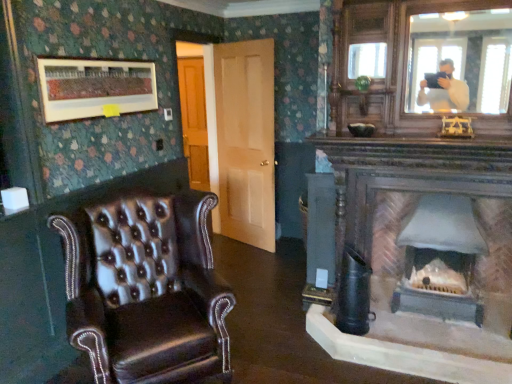
Question: Can you confirm if light brown wood door at center is positioned to the left of matte gray stone fireplace at center?

Choices:
 (A) no
 (B) yes

Answer: (B)

Question: Considering the relative sizes of light brown wood door at center and matte gray stone fireplace at center in the image provided, is light brown wood door at center smaller than matte gray stone fireplace at center?

Choices:
 (A) no
 (B) yes

Answer: (A)

Question: Are light brown wood door at center and matte gray stone fireplace at center making contact?

Choices:
 (A) yes
 (B) no

Answer: (B)

Question: From the image's perspective, is light brown wood door at center over matte gray stone fireplace at center?

Choices:
 (A) yes
 (B) no

Answer: (A)

Question: Considering the relative sizes of light brown wood door at center and matte gray stone fireplace at center in the image provided, is light brown wood door at center wider than matte gray stone fireplace at center?

Choices:
 (A) no
 (B) yes

Answer: (A)

Question: Is light brown wood door at center oriented away from matte gray stone fireplace at center?

Choices:
 (A) yes
 (B) no

Answer: (B)

Question: From the image's perspective, does matte wooden picture frame at upper left appear higher than leather wingback chair at left?

Choices:
 (A) yes
 (B) no

Answer: (A)

Question: Can you confirm if matte wooden picture frame at upper left is taller than leather wingback chair at left?

Choices:
 (A) no
 (B) yes

Answer: (A)

Question: Is matte wooden picture frame at upper left outside leather wingback chair at left?

Choices:
 (A) yes
 (B) no

Answer: (A)

Question: Can leather wingback chair at left be found inside matte wooden picture frame at upper left?

Choices:
 (A) no
 (B) yes

Answer: (A)

Question: Is matte wooden picture frame at upper left positioned with its back to leather wingback chair at left?

Choices:
 (A) yes
 (B) no

Answer: (B)

Question: Considering the relative sizes of matte wooden picture frame at upper left and leather wingback chair at left in the image provided, is matte wooden picture frame at upper left shorter than leather wingback chair at left?

Choices:
 (A) yes
 (B) no

Answer: (A)

Question: From the image's perspective, would you say leather wingback chair at left is shown under light brown wood door at center?

Choices:
 (A) no
 (B) yes

Answer: (B)